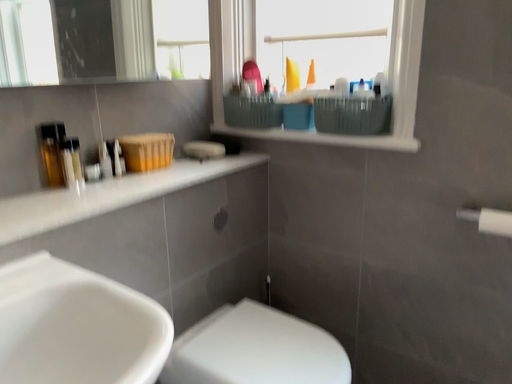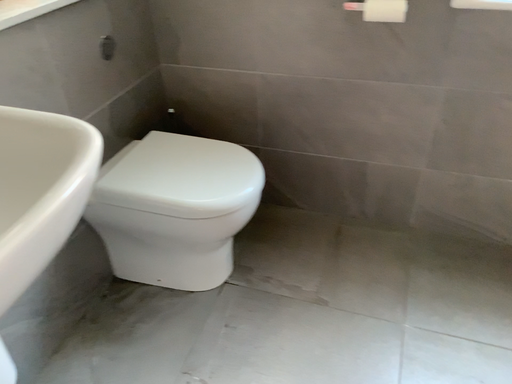
Question: Which way did the camera rotate in the video?

Choices:
 (A) rotated downward
 (B) rotated upward

Answer: (A)